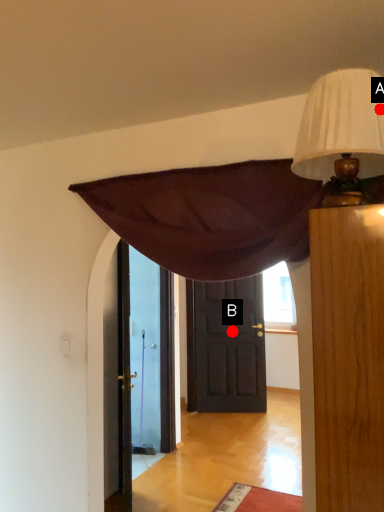
Question: Two points are circled on the image, labeled by A and B beside each circle. Which point appears farthest from the camera in this image?

Choices:
 (A) A is further
 (B) B is further

Answer: (B)